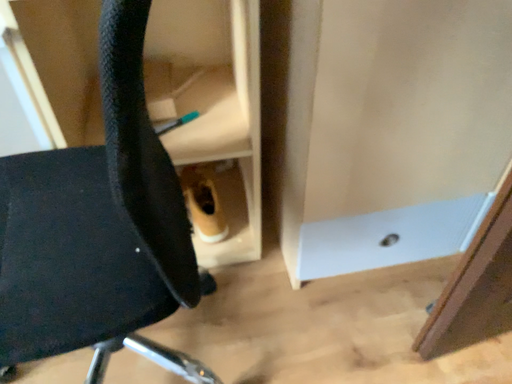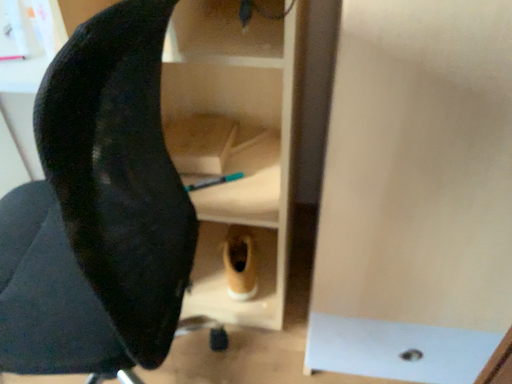
Question: How did the camera likely rotate when shooting the video?

Choices:
 (A) rotated right
 (B) rotated left

Answer: (B)